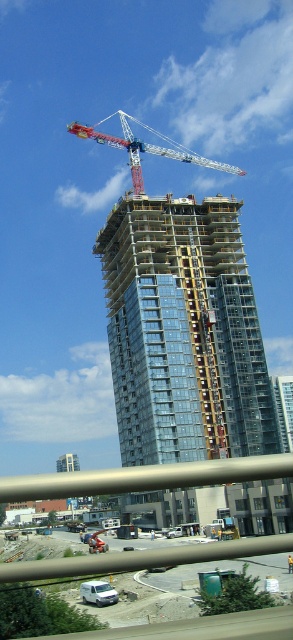
Is glassy steel building at center wider than white matte van at lower center?

Yes.

Can you confirm if glassy steel building at center is taller than white matte van at lower center?

Yes.

This screenshot has width=293, height=640. I want to click on glassy steel building at center, so click(184, 332).

Is white concrete construction site at lower center further to camera compared to red painted metal crane at upper center?

No, it is not.

Does white concrete construction site at lower center appear under red painted metal crane at upper center?

Yes, white concrete construction site at lower center is below red painted metal crane at upper center.

Is point (74, 573) farther from camera compared to point (126, 140)?

No.

You are a GUI agent. You are given a task and a screenshot of the screen. Output one action in this format:
    pyautogui.click(x=<x>, y=<y>)
    Task: Click on the white concrete construction site at lower center
    
    Given the screenshot: What is the action you would take?
    pyautogui.click(x=142, y=557)

Does white concrete construction site at lower center have a larger size compared to white matte van at lower center?

Yes.

Can you confirm if white concrete construction site at lower center is positioned below white matte van at lower center?

Indeed, white concrete construction site at lower center is positioned under white matte van at lower center.

The height and width of the screenshot is (640, 293). What do you see at coordinates (142, 557) in the screenshot?
I see `white concrete construction site at lower center` at bounding box center [142, 557].

Locate an element on the screen. white concrete construction site at lower center is located at coordinates (142, 557).